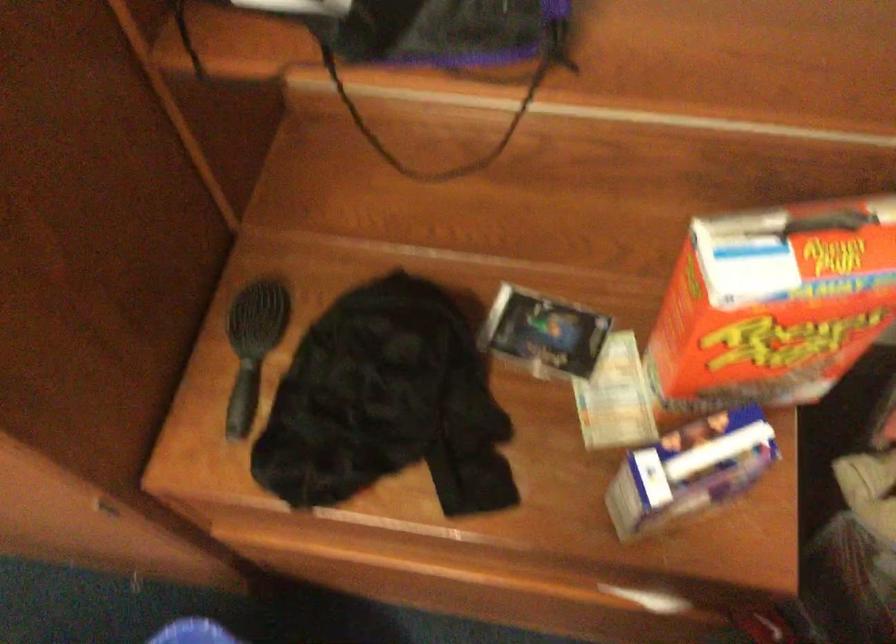
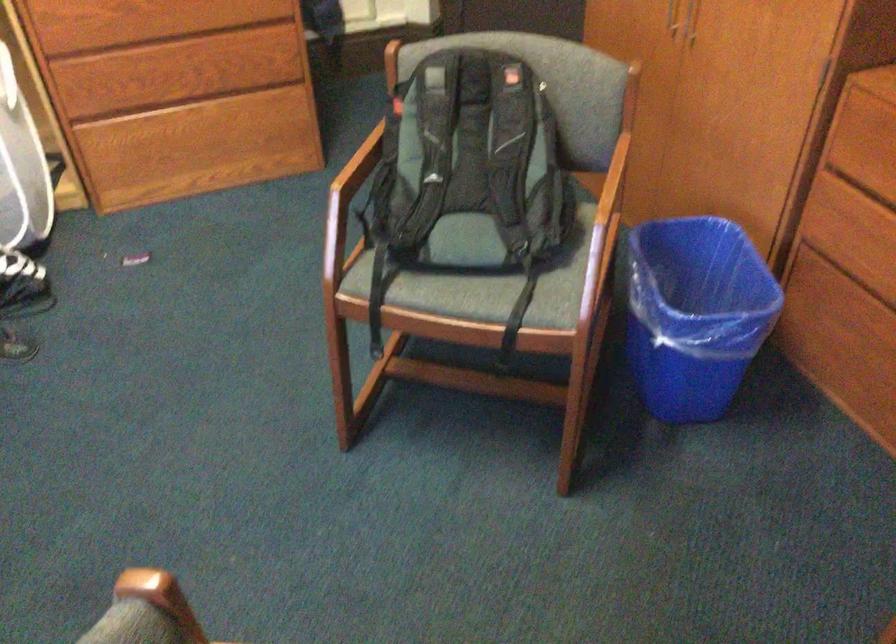
Find the pixel in the second image that matches (255,533) in the first image.

(864, 161)